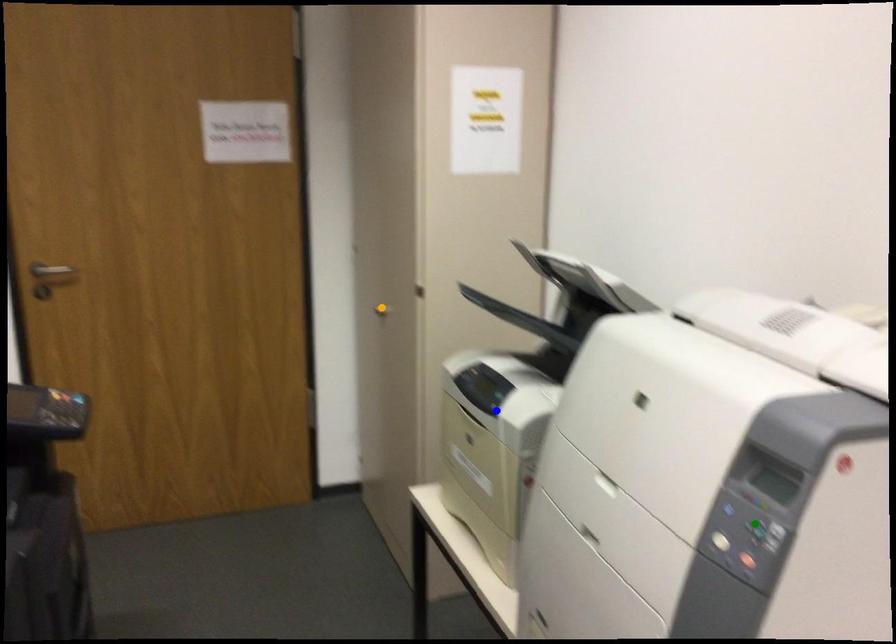
Order these from nearest to farthest:
blue point
orange point
green point

orange point
blue point
green point